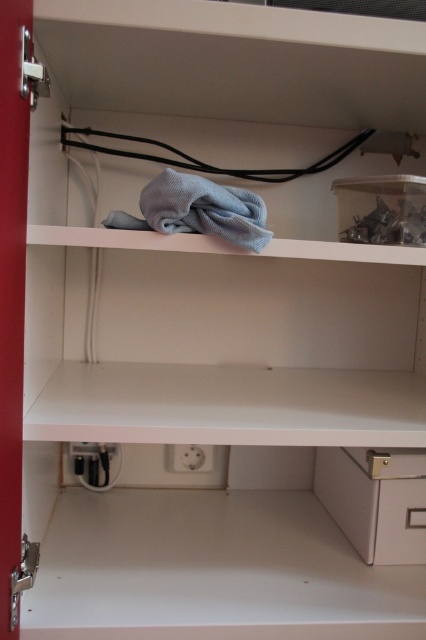
Does white matte drawer at lower right appear on the left side of gray soft cloth at upper center?

In fact, white matte drawer at lower right is to the right of gray soft cloth at upper center.

Identify the location of white matte drawer at lower right. This screenshot has width=426, height=640. (376, 499).

Which is behind, point (394, 500) or point (170, 208)?

The point (394, 500) is behind.

The image size is (426, 640). Identify the location of white matte drawer at lower right. (376, 499).

The width and height of the screenshot is (426, 640). I want to click on gray soft cloth at upper center, so click(x=198, y=211).

Does point (175, 177) lie behind point (187, 465)?

No, (175, 177) is closer to viewer.

You are a GUI agent. You are given a task and a screenshot of the screen. Output one action in this format:
    pyautogui.click(x=<x>, y=<y>)
    Task: Click on the gray soft cloth at upper center
    This screenshot has height=640, width=426.
    Given the screenshot: What is the action you would take?
    pyautogui.click(x=198, y=211)

Can you confirm if white matte drawer at lower right is bigger than white plastic electric outlet at lower center?

Correct, white matte drawer at lower right is larger in size than white plastic electric outlet at lower center.

Is white matte drawer at lower right shorter than white plastic electric outlet at lower center?

No.

Measure the distance between point (359, 493) and camera.

Point (359, 493) and camera are 1.10 meters apart from each other.

The width and height of the screenshot is (426, 640). Find the location of `white matte drawer at lower right`. white matte drawer at lower right is located at coordinates (376, 499).